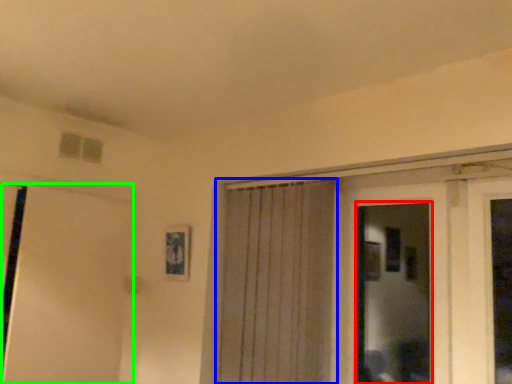
Question: Considering the real-world distances, which object is closest to bay window (highlighted by a red box)? curtain (highlighted by a blue box) or door (highlighted by a green box).

Choices:
 (A) curtain
 (B) door

Answer: (A)